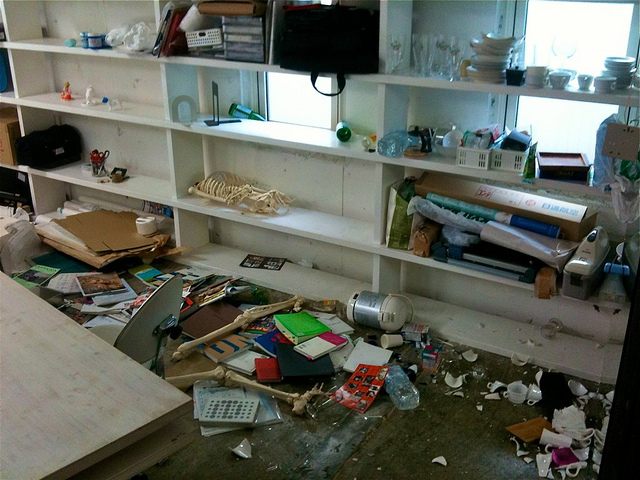
Where is `random objects on middle shelf`? The image size is (640, 480). random objects on middle shelf is located at coordinates (202, 32), (241, 32), (291, 34), (209, 100), (237, 102), (342, 132), (367, 133), (265, 260).